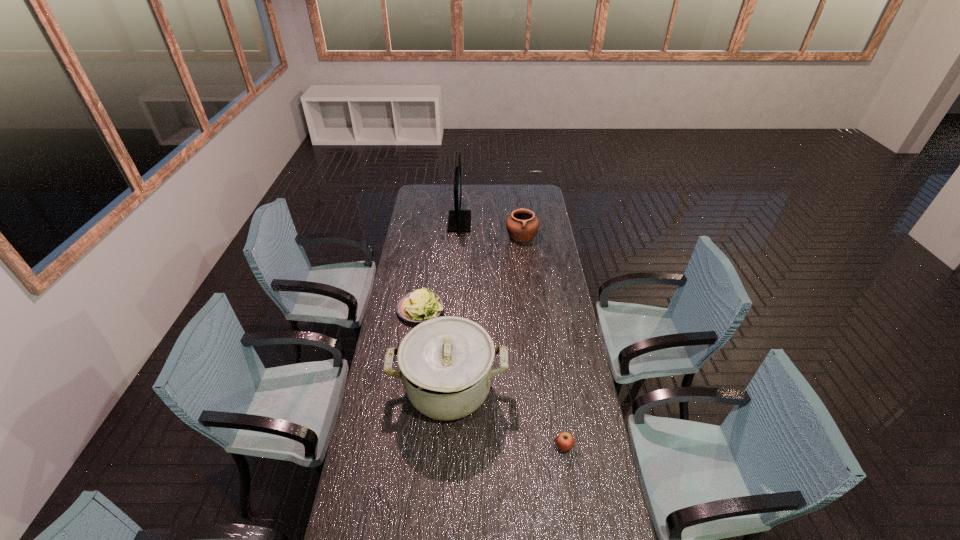
Identify the location of vacant region located 0.080m on the back of the nearest object. (560, 418).

Locate an element on the screen. saucepan that is at the left edge is located at coordinates (446, 363).

The width and height of the screenshot is (960, 540). In order to click on lettuce that is at the left edge in this screenshot , I will do `click(420, 305)`.

Identify the location of pottery at the right edge. This screenshot has height=540, width=960. (522, 226).

I want to click on apple situated at the right edge, so click(x=565, y=441).

In the image, there is a desktop. Find the location of `free region at the far edge`. free region at the far edge is located at coordinates (479, 192).

This screenshot has height=540, width=960. In the image, there is a desktop. In order to click on free space at the left edge in this screenshot , I will do `click(383, 336)`.

Where is `free region at the right edge of the desktop`? The width and height of the screenshot is (960, 540). free region at the right edge of the desktop is located at coordinates (564, 305).

Where is `vacant space at the far right corner of the desktop`? Image resolution: width=960 pixels, height=540 pixels. vacant space at the far right corner of the desktop is located at coordinates (541, 189).

Identify the location of blank region between the tallest object and the saucepan. The width and height of the screenshot is (960, 540). (454, 305).